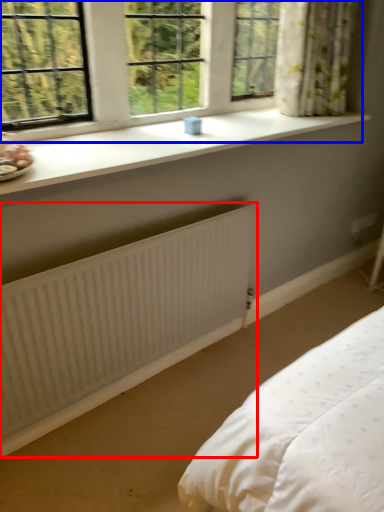
Question: Among these objects, which one is nearest to the camera, radiator (highlighted by a red box) or window (highlighted by a blue box)?

Choices:
 (A) radiator
 (B) window

Answer: (A)